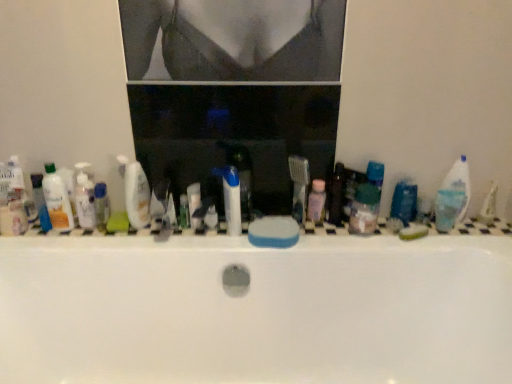
Find the location of a particular element. white plastic bottles at center is located at coordinates (80, 235).

Find the location of a particular element. The height and width of the screenshot is (384, 512). white glossy bathtub at center is located at coordinates (256, 310).

The image size is (512, 384). I want to click on translucent plastic mouthwash at left, the 3th mouthwash when ordered from right to left, so click(x=57, y=199).

Locate an element on the screen. This screenshot has width=512, height=384. white plastic bottles at center is located at coordinates (80, 235).

Is point (210, 237) closer to viewer compared to point (354, 214)?

Yes.

From the image's perspective, is white plastic bottles at center above translucent plastic container at center, which appears as the first mouthwash when viewed from the right?

Incorrect, from the image's perspective, white plastic bottles at center is lower than translucent plastic container at center, which appears as the first mouthwash when viewed from the right.

Who is shorter, white plastic bottles at center or translucent plastic container at center, which is counted as the third mouthwash, starting from the left?

With less height is white plastic bottles at center.

In order to click on ledge behind the translucent plastic container at center, which is counted as the third mouthwash, starting from the left in this screenshot , I will do `click(80, 235)`.

From the image's perspective, between translucent plastic mouthwash at left, the 2th mouthwash from the left, and pink translucent bottle at center, arranged as the 1th toiletry when viewed from the right, which one is located above?

translucent plastic mouthwash at left, the 2th mouthwash from the left, appears higher in the image.

Is pink translucent bottle at center, the 4th toiletry positioned from the left, a part of translucent plastic mouthwash at left, the 2th mouthwash from the left?

No.

Which of these two, translucent plastic mouthwash at left, the 2th mouthwash from the left, or pink translucent bottle at center, arranged as the 1th toiletry when viewed from the right, is wider?

translucent plastic mouthwash at left, the 2th mouthwash from the left, is wider.

Image resolution: width=512 pixels, height=384 pixels. I want to click on the 2nd toiletry below the translucent plastic mouthwash at left, the 2th mouthwash from the left (from a real-world perspective), so click(x=316, y=201).

Locate an element on the screen. the 1st soap below the white glossy bottle at center, which ranks as the third toiletry in left-to-right order (from the image's perspective) is located at coordinates (273, 232).

From the image's perspective, is blue sponge at center, the 1th soap viewed from the left, on top of white glossy bottle at center, which ranks as the third toiletry in left-to-right order?

Actually, blue sponge at center, the 1th soap viewed from the left, appears below white glossy bottle at center, which ranks as the third toiletry in left-to-right order, in the image.

Based on the photo, is blue sponge at center, the 1th soap viewed from the left, next to white glossy bottle at center, which ranks as the third toiletry in left-to-right order?

blue sponge at center, the 1th soap viewed from the left, and white glossy bottle at center, which ranks as the third toiletry in left-to-right order, are not in contact.

Looking at this image, is the position of blue sponge at center, the 1th soap viewed from the left, more distant than that of white glossy bottle at center, which is the 2th toiletry in right-to-left order?

Yes.

From the image's perspective, is translucent plastic bottle at left, the 2th toiletry when ordered from left to right, below pink translucent bottle at center, arranged as the 1th toiletry when viewed from the right?

Yes, from the image's perspective, translucent plastic bottle at left, the 2th toiletry when ordered from left to right, is beneath pink translucent bottle at center, arranged as the 1th toiletry when viewed from the right.

Considering the points (104, 199) and (320, 187), which point is behind, point (104, 199) or point (320, 187)?

Positioned behind is point (104, 199).

Is translucent plastic bottle at left, which ranks as the 3th toiletry in right-to-left order, positioned far away from pink translucent bottle at center, the 4th toiletry positioned from the left?

Actually, translucent plastic bottle at left, which ranks as the 3th toiletry in right-to-left order, and pink translucent bottle at center, the 4th toiletry positioned from the left, are a little close together.

Is green matte bar of soap at right, which is counted as the 1th soap, starting from the right, at the right side of translucent plastic mouthwash at left, positioned as the 1th mouthwash in left-to-right order?

Correct, you'll find green matte bar of soap at right, which is counted as the 1th soap, starting from the right, to the right of translucent plastic mouthwash at left, positioned as the 1th mouthwash in left-to-right order.

Between point (405, 233) and point (72, 220), which one is positioned in front?

The point (405, 233) is closer.

Which of these two, green matte bar of soap at right, which is counted as the 1th soap, starting from the right, or translucent plastic mouthwash at left, the 3th mouthwash when ordered from right to left, is smaller?

With smaller size is green matte bar of soap at right, which is counted as the 1th soap, starting from the right.

Image resolution: width=512 pixels, height=384 pixels. Find the location of `the 3rd mouthwash to the left when counting from the green matte bar of soap at right, which is counted as the 1th soap, starting from the right`. the 3rd mouthwash to the left when counting from the green matte bar of soap at right, which is counted as the 1th soap, starting from the right is located at coordinates (57, 199).

Is translucent plastic mouthwash at left, positioned as the 1th mouthwash in left-to-right order, beside pink translucent bottle at center, arranged as the 1th toiletry when viewed from the right?

No, translucent plastic mouthwash at left, positioned as the 1th mouthwash in left-to-right order, is not touching pink translucent bottle at center, arranged as the 1th toiletry when viewed from the right.

Who is taller, translucent plastic mouthwash at left, the 3th mouthwash when ordered from right to left, or pink translucent bottle at center, arranged as the 1th toiletry when viewed from the right?

translucent plastic mouthwash at left, the 3th mouthwash when ordered from right to left, is taller.

In the scene shown: From the image's perspective, which is below, translucent plastic mouthwash at left, positioned as the 1th mouthwash in left-to-right order, or pink translucent bottle at center, arranged as the 1th toiletry when viewed from the right?

pink translucent bottle at center, arranged as the 1th toiletry when viewed from the right, is shown below in the image.

Which of these two, pink translucent bottle at center, arranged as the 1th toiletry when viewed from the right, or translucent plastic container at center, which is counted as the third mouthwash, starting from the left, is thinner?

With smaller width is pink translucent bottle at center, arranged as the 1th toiletry when viewed from the right.

Between pink translucent bottle at center, arranged as the 1th toiletry when viewed from the right, and translucent plastic container at center, which appears as the first mouthwash when viewed from the right, which one is positioned behind?

pink translucent bottle at center, arranged as the 1th toiletry when viewed from the right, is behind.

From the image's perspective, is pink translucent bottle at center, the 4th toiletry positioned from the left, below translucent plastic container at center, which is counted as the third mouthwash, starting from the left?

No.

Does point (312, 213) come in front of point (357, 203)?

No.

Where is `the 2nd mouthwash in front of the white plastic bottles at center`? Image resolution: width=512 pixels, height=384 pixels. the 2nd mouthwash in front of the white plastic bottles at center is located at coordinates (364, 209).

This screenshot has width=512, height=384. I want to click on the 1st mouthwash positioned above the pink translucent bottle at center, arranged as the 1th toiletry when viewed from the right (from a real-world perspective), so click(84, 197).

Looking at this image, from the image, which object appears to be nearer to white plastic bottles at center, green matte bar of soap at right, the 2th soap viewed from the left, or translucent plastic mouthwash at left, the 3th mouthwash when ordered from right to left?

Based on the image, green matte bar of soap at right, the 2th soap viewed from the left, appears to be nearer to white plastic bottles at center.

In the scene shown: Based on their spatial positions, is translucent plastic mouthwash at left, the 3th mouthwash when ordered from right to left, or white plastic bottles at center further from green matte bar of soap at right, which is counted as the 1th soap, starting from the right?

translucent plastic mouthwash at left, the 3th mouthwash when ordered from right to left, is further to green matte bar of soap at right, which is counted as the 1th soap, starting from the right.

Which object lies nearer to the anchor point white glossy bottle at center, which is the 2th toiletry in right-to-left order, translucent plastic mouthwash at left, placed as the 2th mouthwash when sorted from right to left, or translucent plastic mouthwash at left, positioned as the 1th mouthwash in left-to-right order?

translucent plastic mouthwash at left, placed as the 2th mouthwash when sorted from right to left.

Based on the photo, considering their positions, is pink translucent bottle at center, the 4th toiletry positioned from the left, positioned closer to transparent plastic medicine cabinet at center than white glossy bathtub at center?

pink translucent bottle at center, the 4th toiletry positioned from the left, is closer to transparent plastic medicine cabinet at center.

When comparing their distances from white glossy bathtub at center, does translucent plastic container at center, which appears as the first mouthwash when viewed from the right, or blue sponge at center, which ranks as the second soap in right-to-left order, seem closer?

Based on the image, blue sponge at center, which ranks as the second soap in right-to-left order, appears to be nearer to white glossy bathtub at center.

Which object lies nearer to the anchor point white glossy bathtub at center, white glossy toothpaste at center or white plastic bottles at center?

white plastic bottles at center is positioned closer to the anchor white glossy bathtub at center.

From the image, which object appears to be farther from translucent plastic bottle at left, which ranks as the 4th toiletry in right-to-left order, white glossy toothpaste at center or blue sponge at center, the 1th soap viewed from the left?

blue sponge at center, the 1th soap viewed from the left, is further to translucent plastic bottle at left, which ranks as the 4th toiletry in right-to-left order.

Estimate the real-world distances between objects in this image. Which object is closer to white glossy bottle at center, which ranks as the third toiletry in left-to-right order, pink translucent bottle at center, arranged as the 1th toiletry when viewed from the right, or translucent plastic bottle at left, marked as the 1th toiletry in a left-to-right arrangement?

Based on the image, translucent plastic bottle at left, marked as the 1th toiletry in a left-to-right arrangement, appears to be nearer to white glossy bottle at center, which ranks as the third toiletry in left-to-right order.

Where is `mouthwash between translucent plastic mouthwash at left, the 3th mouthwash when ordered from right to left, and white glossy toothpaste at center`? This screenshot has width=512, height=384. mouthwash between translucent plastic mouthwash at left, the 3th mouthwash when ordered from right to left, and white glossy toothpaste at center is located at coordinates pos(84,197).

Locate an element on the screen. The width and height of the screenshot is (512, 384). medicine cabinet between translucent plastic bottle at left, which ranks as the 4th toiletry in right-to-left order, and green matte bar of soap at right, which is counted as the 1th soap, starting from the right, from left to right is located at coordinates (234, 91).

Where is `ledge located between white glossy toothpaste at center and green matte bar of soap at right, the 2th soap viewed from the left, in the left-right direction`? This screenshot has height=384, width=512. ledge located between white glossy toothpaste at center and green matte bar of soap at right, the 2th soap viewed from the left, in the left-right direction is located at coordinates (80, 235).

The image size is (512, 384). Find the location of `ledge located between white glossy bottle at center, which ranks as the third toiletry in left-to-right order, and translucent plastic container at center, which is counted as the third mouthwash, starting from the left, in the left-right direction`. ledge located between white glossy bottle at center, which ranks as the third toiletry in left-to-right order, and translucent plastic container at center, which is counted as the third mouthwash, starting from the left, in the left-right direction is located at coordinates 80,235.